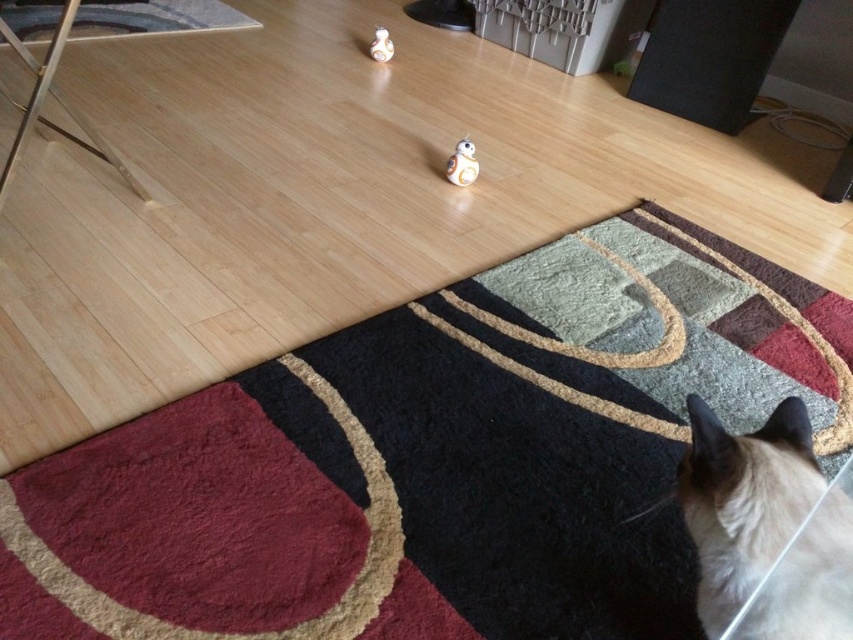
Is silky white cat at lower right bigger than white plastic bb8 at center?

Yes.

In the scene shown: Is silky white cat at lower right shorter than white plastic bb8 at center?

In fact, silky white cat at lower right may be taller than white plastic bb8 at center.

Does point (711, 544) lie behind point (473, 177)?

No.

I want to click on silky white cat at lower right, so click(x=743, y=500).

Is silky white cat at lower right thinner than white glossy figurine at upper center?

No.

Is point (724, 604) farther from camera compared to point (387, 42)?

No, (724, 604) is closer to viewer.

Find the location of a particular element. silky white cat at lower right is located at coordinates (743, 500).

Can you confirm if black textured rug at upper left is taller than white glossy figurine at upper center?

Correct, black textured rug at upper left is much taller as white glossy figurine at upper center.

Does black textured rug at upper left appear under white glossy figurine at upper center?

Actually, black textured rug at upper left is above white glossy figurine at upper center.

Is point (154, 10) positioned behind point (376, 56)?

That is True.

Where is `black textured rug at upper left`? Image resolution: width=853 pixels, height=640 pixels. black textured rug at upper left is located at coordinates (161, 17).